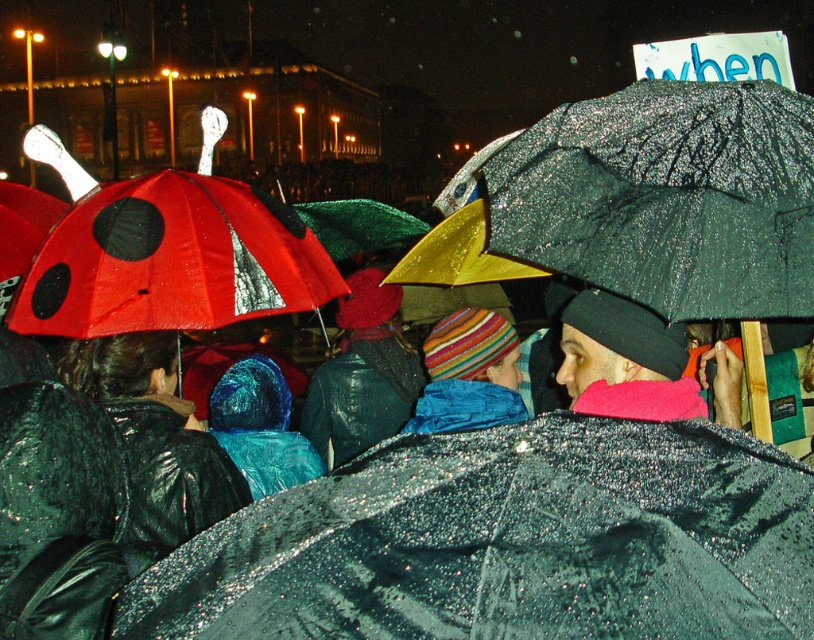
Is shiny black umbrella at center to the right of shiny black jacket at left from the viewer's perspective?

Correct, you'll find shiny black umbrella at center to the right of shiny black jacket at left.

What do you see at coordinates (506, 541) in the screenshot? I see `shiny black umbrella at center` at bounding box center [506, 541].

Identify the location of shiny black umbrella at center. This screenshot has height=640, width=814. (506, 541).

Between point (709, 595) and point (317, 368), which one is positioned in front?

Point (709, 595)

At what (x,y) coordinates should I click in order to perform the action: click on shiny black umbrella at center. Please return your answer as a coordinate pair (x, y). Image resolution: width=814 pixels, height=640 pixels. Looking at the image, I should click on coord(506,541).

Locate an element on the screen. The width and height of the screenshot is (814, 640). shiny black umbrella at center is located at coordinates (506, 541).

Can you confirm if shiny black umbrella at center is thinner than striped wool hat at center?

In fact, shiny black umbrella at center might be wider than striped wool hat at center.

Is point (659, 449) farther from camera compared to point (513, 410)?

No, it is in front of (513, 410).

Image resolution: width=814 pixels, height=640 pixels. Find the location of `shiny black umbrella at center`. shiny black umbrella at center is located at coordinates (506, 541).

You are a GUI agent. You are given a task and a screenshot of the screen. Output one action in this format:
    pyautogui.click(x=<x>, y=<y>)
    Task: Click on the shiny black umbrella at center
    
    Given the screenshot: What is the action you would take?
    pyautogui.click(x=506, y=541)